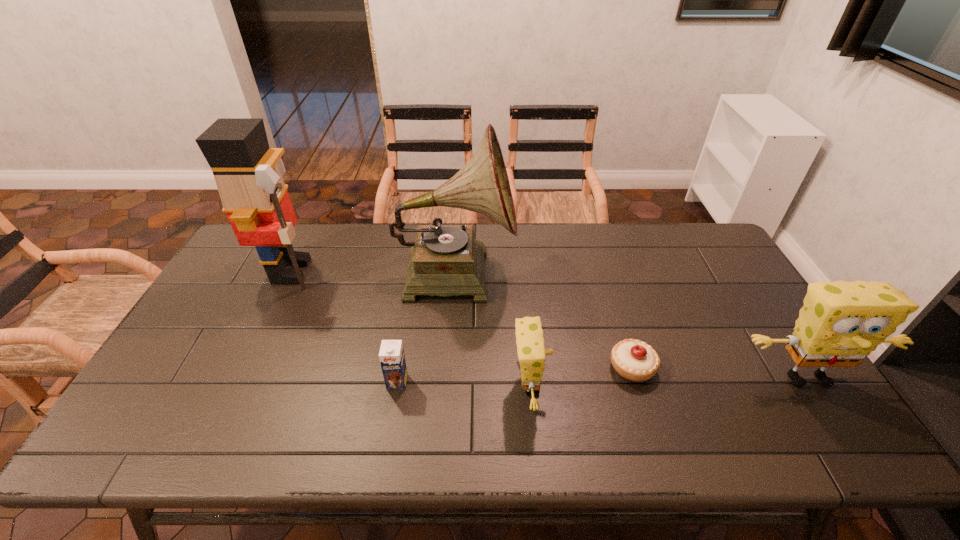
The height and width of the screenshot is (540, 960). Find the location of `vacant space that satisfies the following two spatial constraints: 1. from the horn of the pastry; 2. on the right side of the record player`. vacant space that satisfies the following two spatial constraints: 1. from the horn of the pastry; 2. on the right side of the record player is located at coordinates (449, 367).

I want to click on free spot that satisfies the following two spatial constraints: 1. from the horn of the record player; 2. on the right side of the shortest object, so click(449, 367).

Locate an element on the screen. free space that satisfies the following two spatial constraints: 1. in front of the pastry holding the staff; 2. on the right side of the leftmost object is located at coordinates (245, 367).

Where is `free space that satisfies the following two spatial constraints: 1. from the horn of the record player; 2. on the front label of the chocolate milk`? Image resolution: width=960 pixels, height=540 pixels. free space that satisfies the following two spatial constraints: 1. from the horn of the record player; 2. on the front label of the chocolate milk is located at coordinates (448, 382).